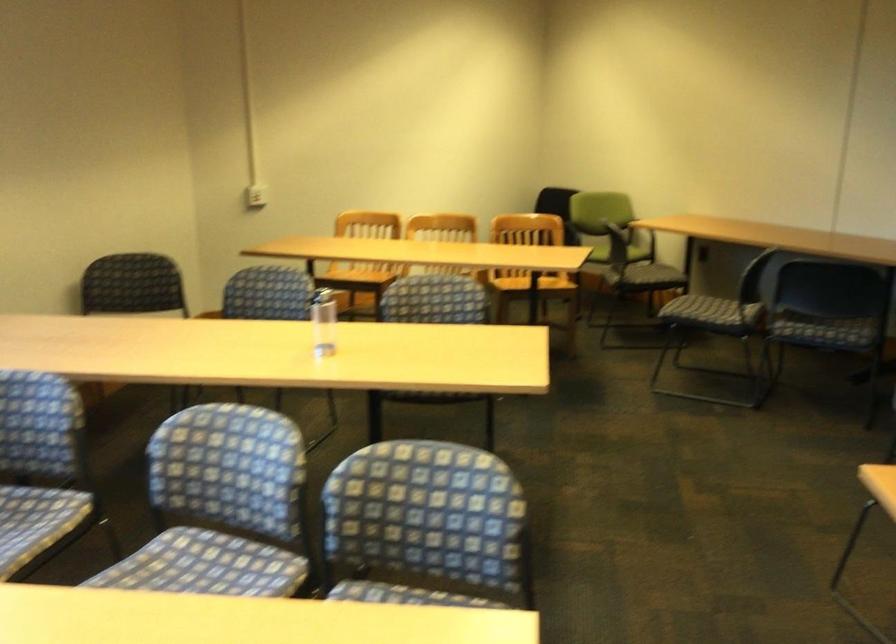
Locate an element on the screen. Image resolution: width=896 pixels, height=644 pixels. blue patterned sitting surface is located at coordinates (425, 527).